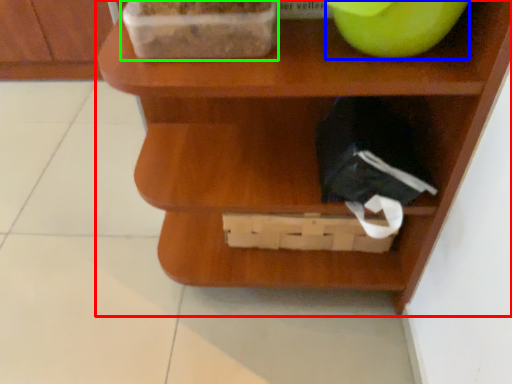
Question: Which object is the farthest from shelf (highlighted by a red box)? Choose among these: apple (highlighted by a blue box) or wide (highlighted by a green box).

Choices:
 (A) apple
 (B) wide

Answer: (A)